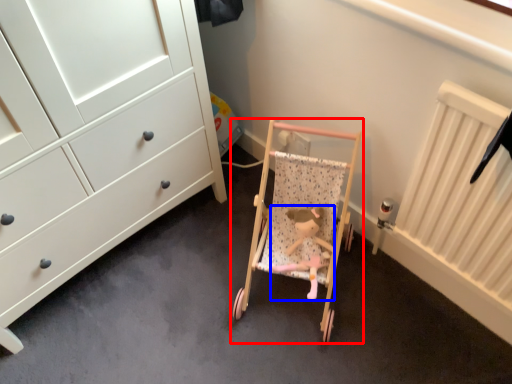
Question: Among these objects, which one is nearest to the camera, furniture (highlighted by a red box) or toy (highlighted by a blue box)?

Choices:
 (A) furniture
 (B) toy

Answer: (A)